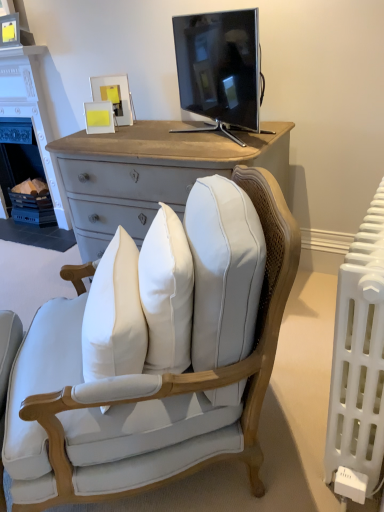
Question: From a real-world perspective, is black glossy tv at upper center on white plastic radiator at right?

Choices:
 (A) yes
 (B) no

Answer: (A)

Question: Is black glossy tv at upper center thinner than white plastic radiator at right?

Choices:
 (A) yes
 (B) no

Answer: (B)

Question: Does black glossy tv at upper center have a greater height compared to white plastic radiator at right?

Choices:
 (A) no
 (B) yes

Answer: (A)

Question: From a real-world perspective, is black glossy tv at upper center located beneath white plastic radiator at right?

Choices:
 (A) no
 (B) yes

Answer: (A)

Question: Can you confirm if black glossy tv at upper center is bigger than white plastic radiator at right?

Choices:
 (A) no
 (B) yes

Answer: (A)

Question: From a real-world perspective, is white painted wood fireplace at left above or below black glossy tv at upper center?

Choices:
 (A) below
 (B) above

Answer: (A)

Question: From the image's perspective, is white painted wood fireplace at left positioned above or below black glossy tv at upper center?

Choices:
 (A) below
 (B) above

Answer: (B)

Question: Looking at their shapes, would you say white painted wood fireplace at left is wider or thinner than black glossy tv at upper center?

Choices:
 (A) wide
 (B) thin

Answer: (B)

Question: From their relative heights in the image, would you say white painted wood fireplace at left is taller or shorter than black glossy tv at upper center?

Choices:
 (A) short
 (B) tall

Answer: (B)

Question: Considering the positions of point (160, 480) and point (36, 69), is point (160, 480) closer or farther from the camera than point (36, 69)?

Choices:
 (A) closer
 (B) farther

Answer: (A)

Question: Relative to white painted wood fireplace at left, is light blue fabric chair at center in front or behind?

Choices:
 (A) front
 (B) behind

Answer: (A)

Question: From a real-world perspective, is light blue fabric chair at center positioned above or below white painted wood fireplace at left?

Choices:
 (A) below
 (B) above

Answer: (A)

Question: Do you think light blue fabric chair at center is within white painted wood fireplace at left, or outside of it?

Choices:
 (A) inside
 (B) outside

Answer: (B)

Question: Considering their positions, is white plastic radiator at right located in front of or behind black glossy tv at upper center?

Choices:
 (A) front
 (B) behind

Answer: (A)

Question: From a real-world perspective, is white plastic radiator at right above or below black glossy tv at upper center?

Choices:
 (A) above
 (B) below

Answer: (B)